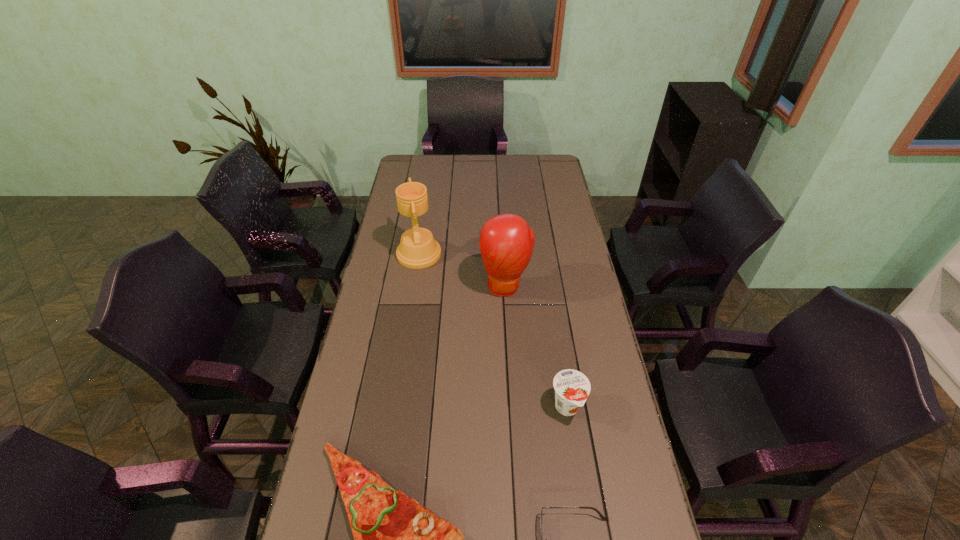
Where is `boxing glove`? This screenshot has width=960, height=540. boxing glove is located at coordinates (506, 242).

The image size is (960, 540). In order to click on award in this screenshot , I will do `click(418, 249)`.

I want to click on the third tallest object, so click(x=572, y=387).

This screenshot has width=960, height=540. In order to click on yogurt in this screenshot , I will do `click(572, 387)`.

Where is `vacant area situated 0.210m on the striking surface of the boxing glove`? vacant area situated 0.210m on the striking surface of the boxing glove is located at coordinates (509, 352).

Image resolution: width=960 pixels, height=540 pixels. What are the coordinates of `vacant space positioned 0.080m on the back of the award` in the screenshot? It's located at click(x=423, y=225).

At what (x,y) coordinates should I click in order to perform the action: click on vacant space positioned on the back of the yogurt. Please return your answer as a coordinate pair (x, y). This screenshot has width=960, height=540. Looking at the image, I should click on (x=551, y=304).

At what (x,y) coordinates should I click in order to perform the action: click on object present at the left edge. Please return your answer as a coordinate pair (x, y). Image resolution: width=960 pixels, height=540 pixels. Looking at the image, I should click on (418, 249).

Identify the location of object at the right edge. (572, 387).

The image size is (960, 540). In order to click on free space at the far edge in this screenshot , I will do `click(506, 156)`.